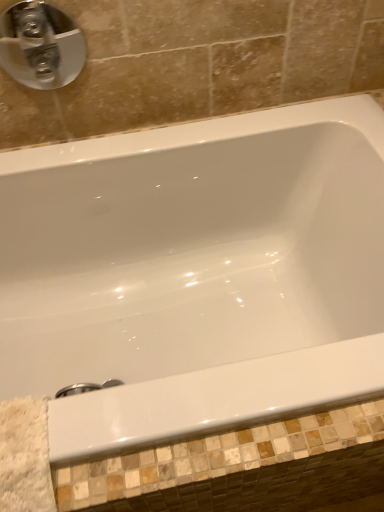
Question: Can white glossy bathtub at center be found inside satin nickel faucet at upper left?

Choices:
 (A) no
 (B) yes

Answer: (A)

Question: Considering the relative sizes of satin nickel faucet at upper left and white glossy bathtub at center in the image provided, is satin nickel faucet at upper left smaller than white glossy bathtub at center?

Choices:
 (A) no
 (B) yes

Answer: (B)

Question: Would you say satin nickel faucet at upper left is outside white glossy bathtub at center?

Choices:
 (A) yes
 (B) no

Answer: (A)

Question: Would you consider satin nickel faucet at upper left to be distant from white glossy bathtub at center?

Choices:
 (A) no
 (B) yes

Answer: (A)

Question: Is the depth of satin nickel faucet at upper left greater than that of white glossy bathtub at center?

Choices:
 (A) no
 (B) yes

Answer: (B)

Question: From a real-world perspective, is satin nickel faucet at upper left over white glossy bathtub at center?

Choices:
 (A) no
 (B) yes

Answer: (B)

Question: Can you confirm if white glossy bathtub at center is taller than satin nickel faucet at upper left?

Choices:
 (A) yes
 (B) no

Answer: (B)

Question: Is white glossy bathtub at center touching satin nickel faucet at upper left?

Choices:
 (A) no
 (B) yes

Answer: (A)

Question: Considering the relative sizes of white glossy bathtub at center and satin nickel faucet at upper left in the image provided, is white glossy bathtub at center bigger than satin nickel faucet at upper left?

Choices:
 (A) no
 (B) yes

Answer: (B)

Question: Is white glossy bathtub at center further to camera compared to satin nickel faucet at upper left?

Choices:
 (A) yes
 (B) no

Answer: (B)

Question: Is satin nickel faucet at upper left inside white glossy bathtub at center?

Choices:
 (A) no
 (B) yes

Answer: (A)

Question: Is white glossy bathtub at center facing away from satin nickel faucet at upper left?

Choices:
 (A) yes
 (B) no

Answer: (B)

Question: Relative to satin nickel faucet at upper left, is white glossy bathtub at center in front or behind?

Choices:
 (A) behind
 (B) front

Answer: (B)